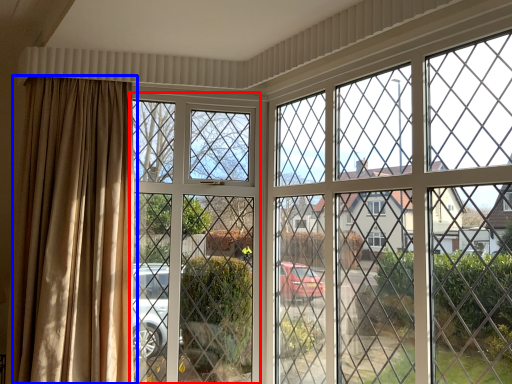
Question: Which of the following is the farthest to the observer, screen door (highlighted by a red box) or curtain (highlighted by a blue box)?

Choices:
 (A) screen door
 (B) curtain

Answer: (A)